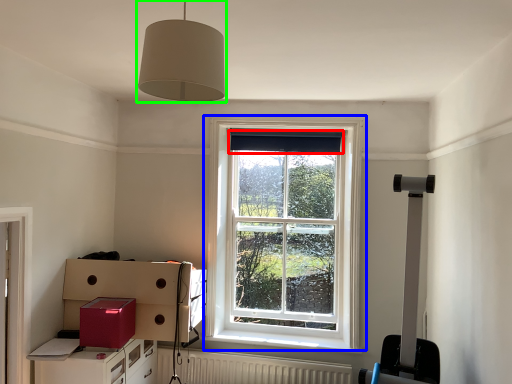
Question: Based on their relative distances, which object is farther from curtain (highlighted by a red box)? Choose from window (highlighted by a blue box) and light fixture (highlighted by a green box).

Choices:
 (A) window
 (B) light fixture

Answer: (B)